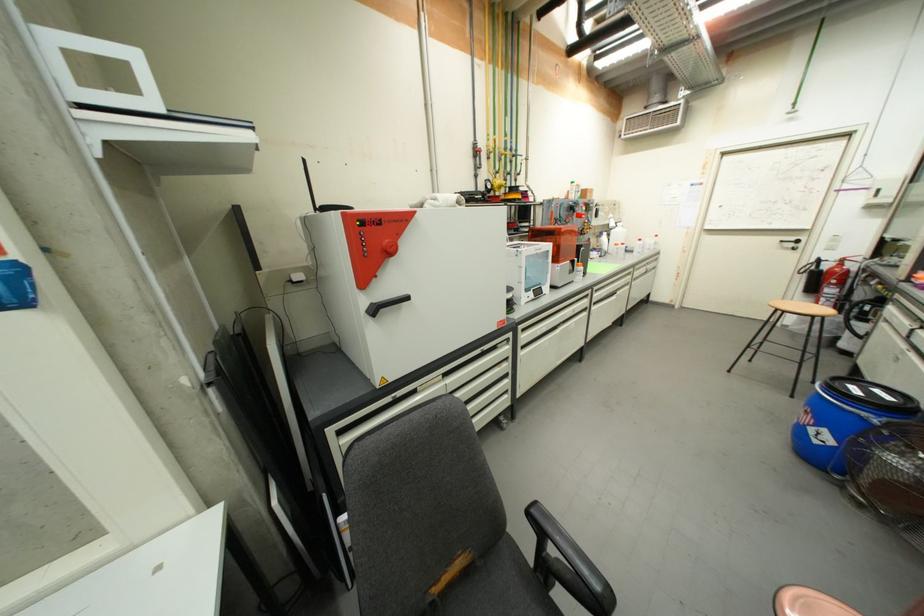
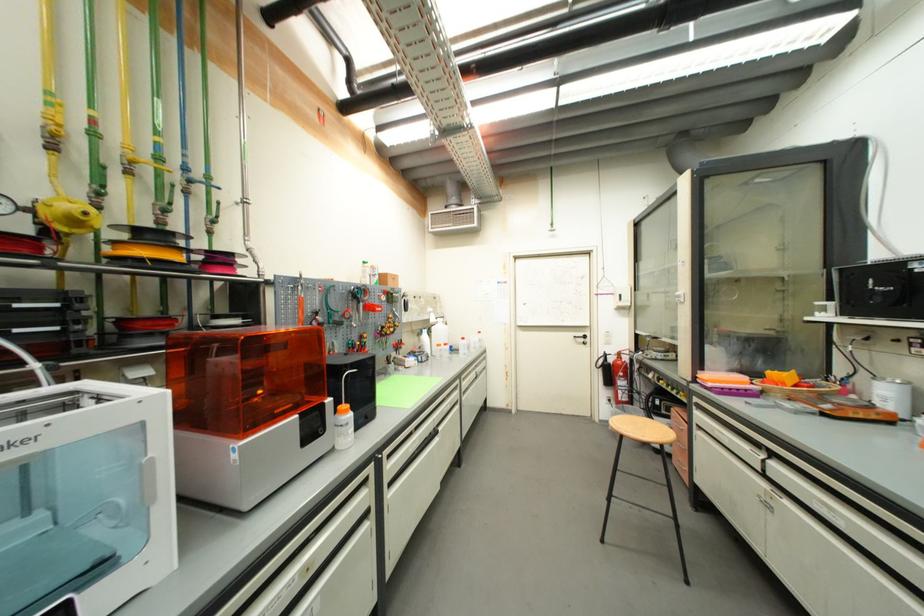
Find the pixel in the second image that matches pixel 493 140 in the first image.

(55, 106)